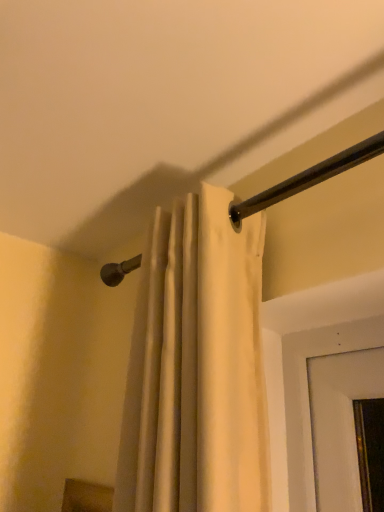
You are a GUI agent. You are given a task and a screenshot of the screen. Output one action in this format:
    pyautogui.click(x=<x>, y=<y>)
    Task: Click on the white fabric shower curtain at upper center
    
    Given the screenshot: What is the action you would take?
    pyautogui.click(x=307, y=178)

What do you see at coordinates (307, 178) in the screenshot? This screenshot has height=512, width=384. I see `white fabric shower curtain at upper center` at bounding box center [307, 178].

Measure the distance between white fabric shower curtain at upper center and camera.

white fabric shower curtain at upper center is 22.10 inches from camera.

What is the approximate height of white fabric shower curtain at upper center?

6.07 centimeters.

What is the approximate width of white fabric shower curtain at upper center?

white fabric shower curtain at upper center is 3.86 centimeters wide.

At what (x,y) coordinates should I click in order to perform the action: click on white fabric shower curtain at upper center. Please return your answer as a coordinate pair (x, y). Looking at the image, I should click on (307, 178).